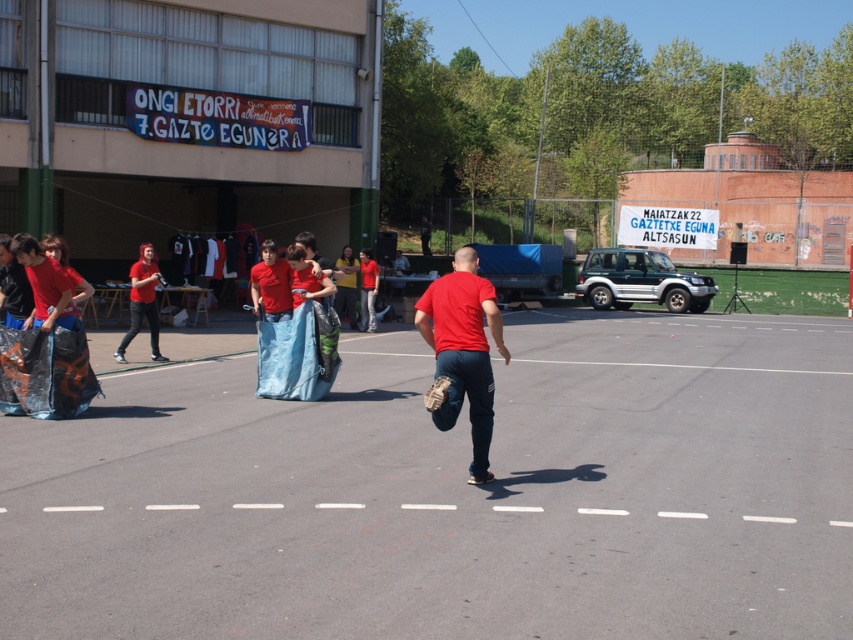
You are standing at the point labeled point (465, 308) and want to throw a ball to someone standing 25 feet away. Can you reach the person with one throw if your maximum throwing distance is 25 feet?

The distance between you and the person is 24.95 feet, which is within your maximum throwing distance of 25 feet. Yes, you can reach them with one throw.

You are standing at the far right of the scene and want to hand a water bottle to both the matte red shirt at center and the matte red shirt at left. Which one should you approach first based on their positions?

You should approach the matte red shirt at left first because they are closer to your current position on the far right compared to the matte red shirt at center, which is further to the left.

You are a photographer trying to capture a wide shot of the matte red shirt at center and the matte red shirt at left. Which of the two requires more focus adjustment due to its size in the frame?

The matte red shirt at center requires more focus adjustment because it has a lesser width compared to the matte red shirt at left, making it smaller in the frame and potentially harder to focus on clearly.